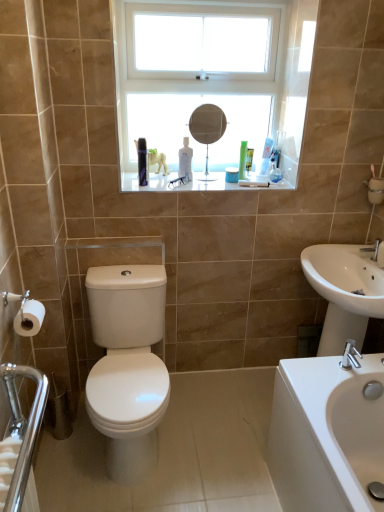
At what (x,y) coordinates should I click in order to perform the action: click on unoccupied region to the right of green matte bottle at upper center, the second toiletry viewed from the top. Please return your answer as a coordinate pair (x, y). Looking at the image, I should click on (267, 179).